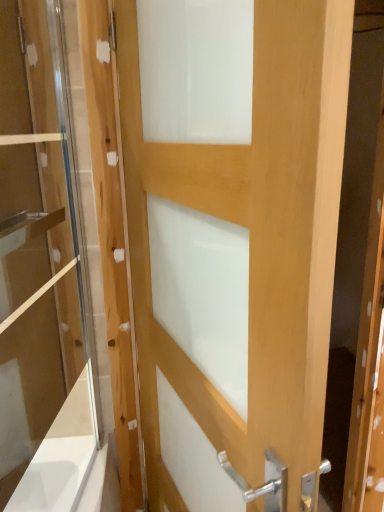
Question: Can you confirm if natural wood door at center is shorter than clear glass door at left?

Choices:
 (A) no
 (B) yes

Answer: (A)

Question: Does natural wood door at center appear on the left side of clear glass door at left?

Choices:
 (A) yes
 (B) no

Answer: (B)

Question: Is natural wood door at center in front of clear glass door at left?

Choices:
 (A) yes
 (B) no

Answer: (A)

Question: Can you confirm if natural wood door at center is taller than clear glass door at left?

Choices:
 (A) no
 (B) yes

Answer: (B)

Question: From a real-world perspective, is natural wood door at center below clear glass door at left?

Choices:
 (A) yes
 (B) no

Answer: (A)

Question: Would you say natural wood door at center contains clear glass door at left?

Choices:
 (A) no
 (B) yes

Answer: (A)

Question: Does clear glass door at left appear on the left side of natural wood door at center?

Choices:
 (A) no
 (B) yes

Answer: (B)

Question: Is clear glass door at left to the right of natural wood door at center from the viewer's perspective?

Choices:
 (A) no
 (B) yes

Answer: (A)

Question: Is clear glass door at left next to natural wood door at center and touching it?

Choices:
 (A) no
 (B) yes

Answer: (A)

Question: Does clear glass door at left turn towards natural wood door at center?

Choices:
 (A) no
 (B) yes

Answer: (B)

Question: Is natural wood door at center surrounded by clear glass door at left?

Choices:
 (A) no
 (B) yes

Answer: (A)

Question: Is clear glass door at left not inside natural wood door at center?

Choices:
 (A) yes
 (B) no

Answer: (A)

Question: Considering the relative positions of clear glass door at left and natural wood door at center in the image provided, is clear glass door at left to the left or to the right of natural wood door at center?

Choices:
 (A) left
 (B) right

Answer: (A)